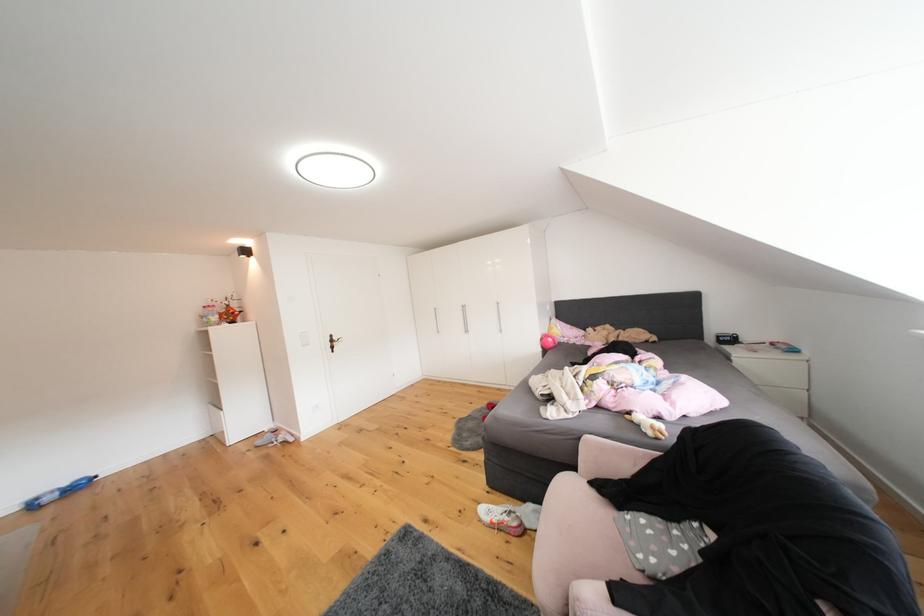
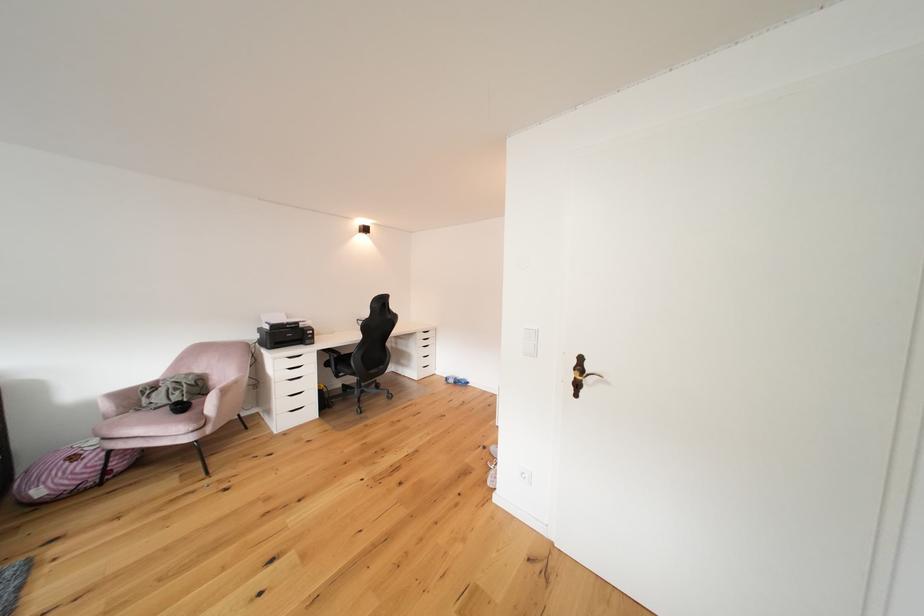
In the second image, find the point that corresponds to pixel 338 347 in the first image.

(580, 379)